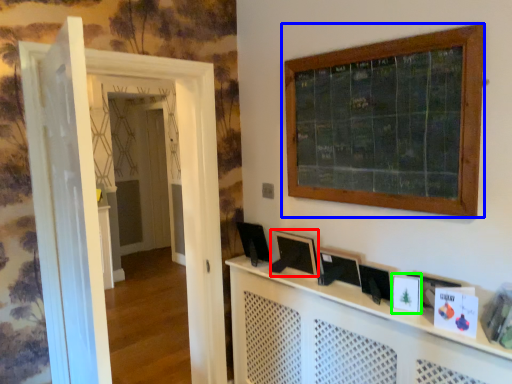
Question: Which object is positioned closest to picture frame (highlighted by a red box)? Select from window (highlighted by a blue box) and picture frame (highlighted by a green box).

Choices:
 (A) window
 (B) picture frame

Answer: (B)